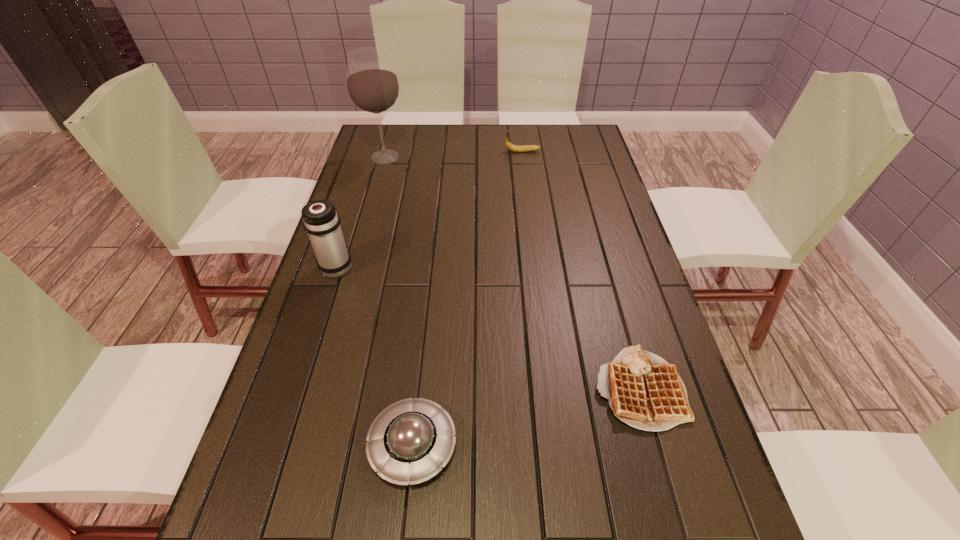
The height and width of the screenshot is (540, 960). Find the location of `vacant space located 0.110m on the side with the handle of the fourth shortest object`. vacant space located 0.110m on the side with the handle of the fourth shortest object is located at coordinates (349, 228).

The image size is (960, 540). I want to click on free space located at the stem of the banana, so click(439, 151).

I want to click on free region located at the stem of the banana, so click(412, 151).

Locate an element on the screen. The width and height of the screenshot is (960, 540). vacant space located 0.200m at the stem of the banana is located at coordinates (450, 151).

Locate an element on the screen. The height and width of the screenshot is (540, 960). vacant space situated 0.160m on the left of the saucer is located at coordinates (287, 445).

Where is `vacant space located 0.180m on the front of the waffle`? The height and width of the screenshot is (540, 960). vacant space located 0.180m on the front of the waffle is located at coordinates (681, 536).

Locate an element on the screen. alcohol that is at the far edge is located at coordinates (372, 84).

The width and height of the screenshot is (960, 540). What are the coordinates of `banana positioned at the far edge` in the screenshot? It's located at (509, 146).

Locate an element on the screen. Image resolution: width=960 pixels, height=540 pixels. alcohol at the left edge is located at coordinates (372, 84).

The height and width of the screenshot is (540, 960). I want to click on thermos bottle that is positioned at the left edge, so click(321, 221).